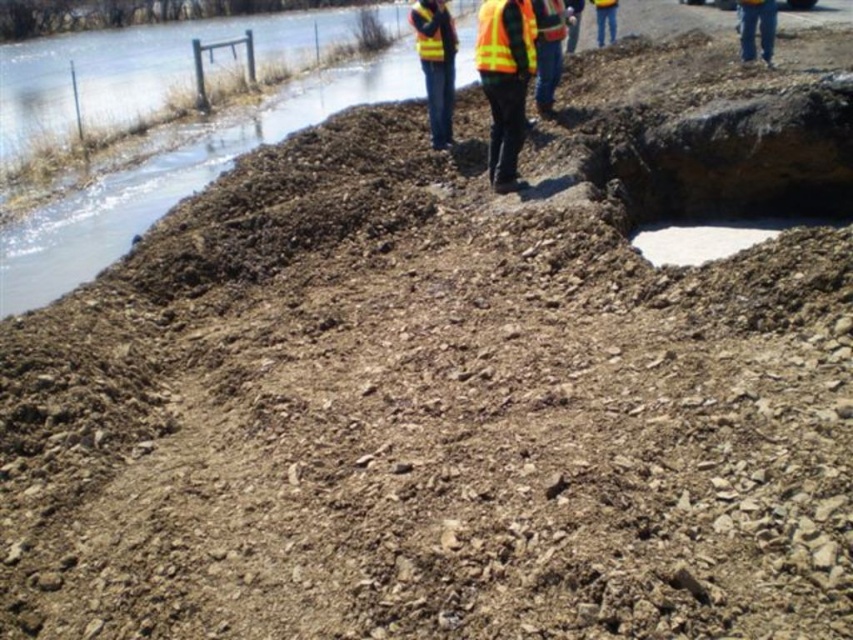
Question: Does high-visibility reflective vest at center have a smaller size compared to high-visibility fabric safety vest at center?

Choices:
 (A) yes
 (B) no

Answer: (A)

Question: Which point is farther from the camera taking this photo?

Choices:
 (A) click(x=444, y=29)
 (B) click(x=476, y=38)
 (C) click(x=583, y=163)
 (D) click(x=497, y=164)

Answer: (B)

Question: Based on their relative distances, which object is farther from the yellow reflective vest at center?

Choices:
 (A) high-visibility fabric safety vest at center
 (B) yellow reflective safety vest at upper center
 (C) white smooth concrete at center

Answer: (C)

Question: Is yellow reflective vest at center thinner than yellow reflective safety vest at upper center?

Choices:
 (A) no
 (B) yes

Answer: (A)

Question: Which object is farther from the camera taking this photo?

Choices:
 (A) yellow reflective safety vest at upper center
 (B) white smooth concrete at center
 (C) yellow reflective vest at center

Answer: (A)

Question: Is white smooth concrete at center wider than high-visibility reflective vest at center?

Choices:
 (A) no
 (B) yes

Answer: (B)